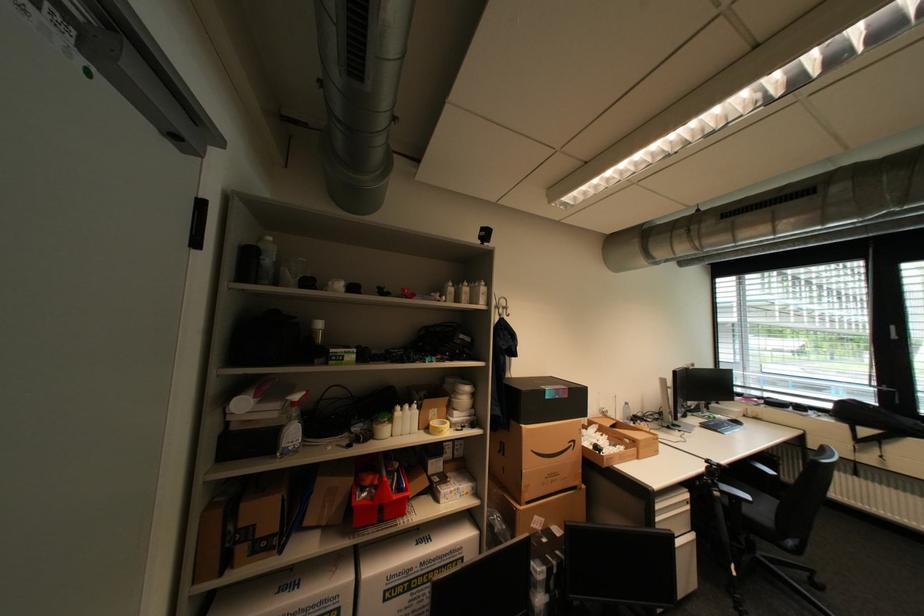
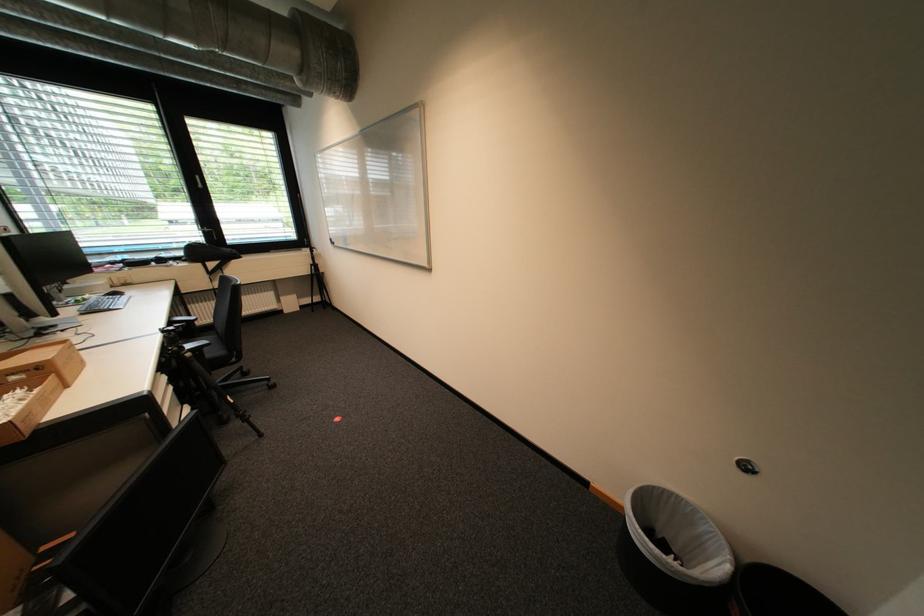
Where in the second image is the point corresponding to pixel 752 504 from the first image?

(213, 350)